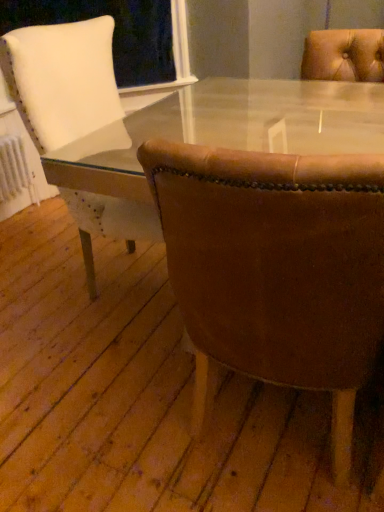
Question: Does brown leather chair at center, which ranks as the second chair in left-to-right order, have a smaller size compared to leather at right, which is the first chair from left to right?

Choices:
 (A) no
 (B) yes

Answer: (B)

Question: From a real-world perspective, is brown leather chair at center, which ranks as the second chair in left-to-right order, positioned under leather at right, the second chair viewed from the right, based on gravity?

Choices:
 (A) no
 (B) yes

Answer: (B)

Question: Is brown leather chair at center, which ranks as the second chair in left-to-right order, aimed at leather at right, the second chair viewed from the right?

Choices:
 (A) no
 (B) yes

Answer: (A)

Question: From the image's perspective, is brown leather chair at center, which ranks as the second chair in left-to-right order, located above leather at right, the second chair viewed from the right?

Choices:
 (A) yes
 (B) no

Answer: (B)

Question: Is brown leather chair at center, marked as the 1th chair in a right-to-left arrangement, facing away from leather at right, the second chair viewed from the right?

Choices:
 (A) yes
 (B) no

Answer: (B)

Question: Does brown leather chair at center, which ranks as the second chair in left-to-right order, have a larger size compared to leather at right, which is the first chair from left to right?

Choices:
 (A) yes
 (B) no

Answer: (B)

Question: Would you say brown leather chair at center, marked as the 1th chair in a right-to-left arrangement, is part of leather at right, the second chair viewed from the right,'s contents?

Choices:
 (A) yes
 (B) no

Answer: (B)

Question: Considering the relative sizes of leather at right, which is the first chair from left to right, and brown leather chair at center, marked as the 1th chair in a right-to-left arrangement, in the image provided, is leather at right, which is the first chair from left to right, shorter than brown leather chair at center, marked as the 1th chair in a right-to-left arrangement,?

Choices:
 (A) yes
 (B) no

Answer: (B)

Question: Considering the relative positions of leather at right, the second chair viewed from the right, and brown leather chair at center, marked as the 1th chair in a right-to-left arrangement, in the image provided, is leather at right, the second chair viewed from the right, to the right of brown leather chair at center, marked as the 1th chair in a right-to-left arrangement, from the viewer's perspective?

Choices:
 (A) no
 (B) yes

Answer: (A)

Question: Does leather at right, which is the first chair from left to right, have a greater width compared to brown leather chair at center, which ranks as the second chair in left-to-right order?

Choices:
 (A) yes
 (B) no

Answer: (A)

Question: Would you say leather at right, the second chair viewed from the right, is outside brown leather chair at center, which ranks as the second chair in left-to-right order?

Choices:
 (A) yes
 (B) no

Answer: (A)

Question: Is leather at right, which is the first chair from left to right, facing towards brown leather chair at center, marked as the 1th chair in a right-to-left arrangement?

Choices:
 (A) no
 (B) yes

Answer: (B)

Question: Visually, is leather at right, the second chair viewed from the right, positioned to the left or to the right of brown leather chair at center, which ranks as the second chair in left-to-right order?

Choices:
 (A) right
 (B) left

Answer: (B)